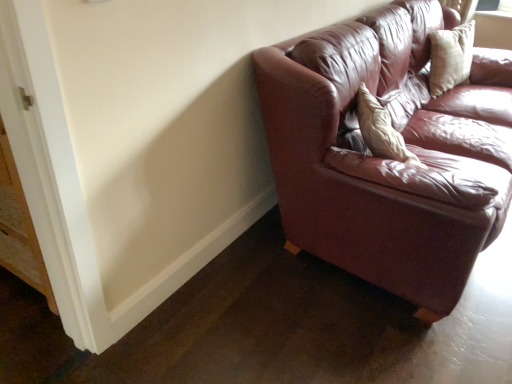
What is the approximate height of beige fabric pillow at upper right?

It is 17.41 inches.

The height and width of the screenshot is (384, 512). Describe the element at coordinates (450, 57) in the screenshot. I see `beige fabric pillow at upper right` at that location.

Where is `beige fabric pillow at upper right`? Image resolution: width=512 pixels, height=384 pixels. beige fabric pillow at upper right is located at coordinates (450, 57).

Find the location of `beige fabric pillow at upper right`. beige fabric pillow at upper right is located at coordinates (450, 57).